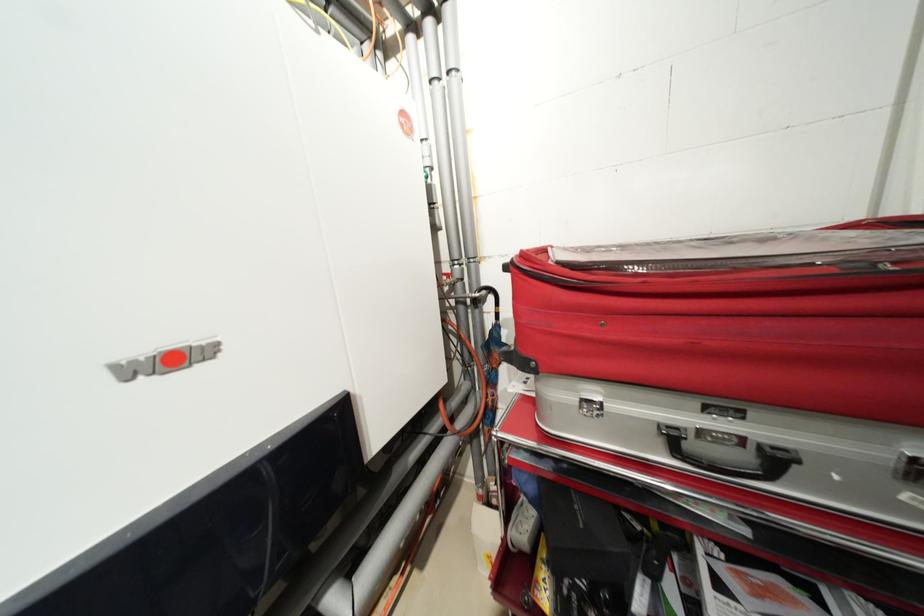
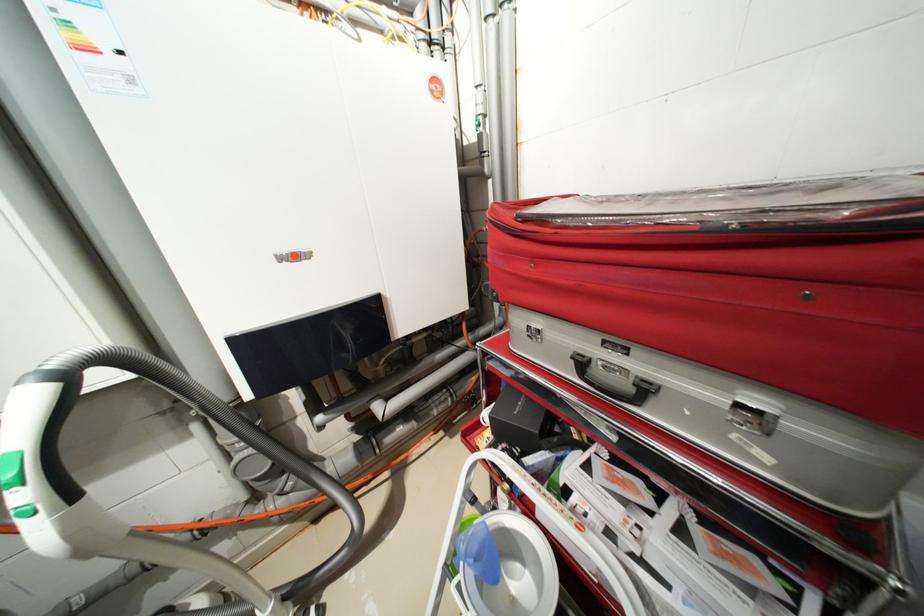
The point at (582,508) is marked in the first image. Where is the corresponding point in the second image?

(527, 403)